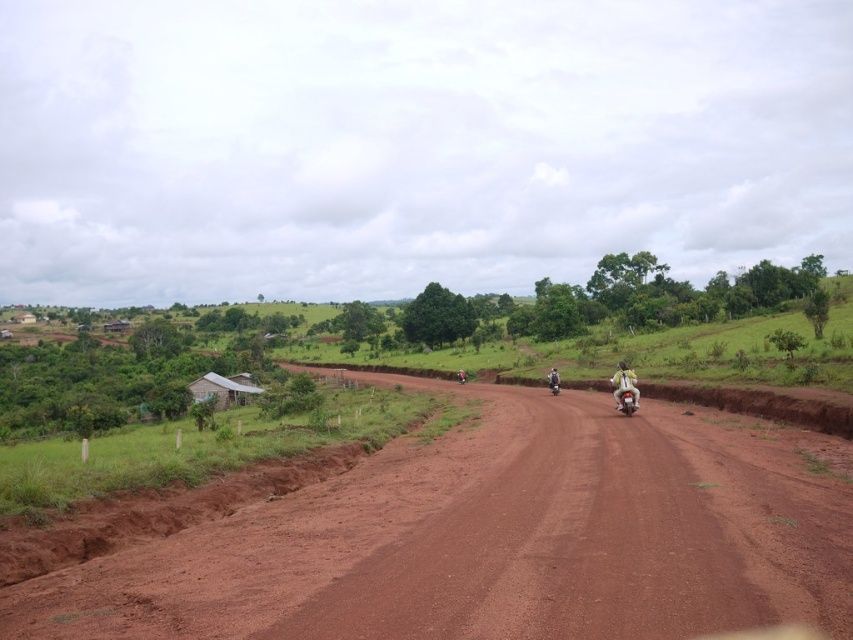
Which of these two, dirt at center or light gray metallic motorcycle at right, stands shorter?

Standing shorter between the two is light gray metallic motorcycle at right.

Which is in front, point (712, 508) or point (618, 406)?

Point (712, 508) is in front.

In order to click on dirt at center in this screenshot , I will do `click(494, 540)`.

Who is more forward, (222, 541) or (556, 376)?

Point (222, 541)

Is dirt at center above white plastic helmet at center?

No, dirt at center is not above white plastic helmet at center.

Who is more forward, [798,502] or [554,371]?

Point [798,502] is more forward.

Find the location of `dirt at center`. dirt at center is located at coordinates (494, 540).

The height and width of the screenshot is (640, 853). Identify the location of light gray metallic motorcycle at right. (624, 385).

Does light gray metallic motorcycle at right have a lesser width compared to white plastic helmet at center?

No.

Who is more distant from viewer, (630, 394) or (550, 372)?

The point (550, 372) is behind.

The height and width of the screenshot is (640, 853). What are the coordinates of `light gray metallic motorcycle at right` in the screenshot? It's located at (624, 385).